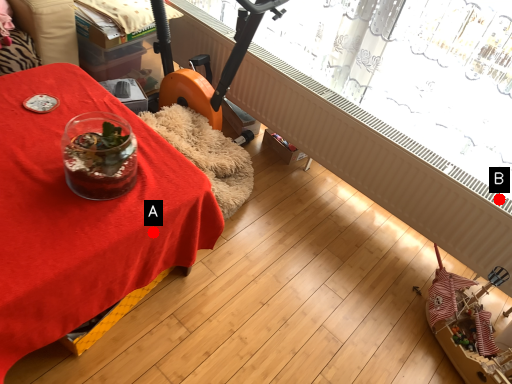
Question: Two points are circled on the image, labeled by A and B beside each circle. Which point is closer to the camera?

Choices:
 (A) A is closer
 (B) B is closer

Answer: (A)